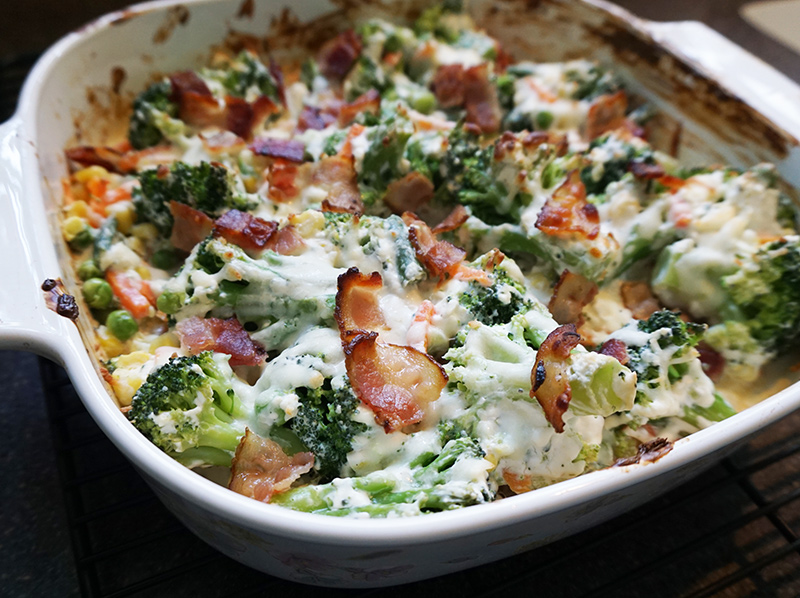
The width and height of the screenshot is (800, 598). Find the location of `cooling rack`. cooling rack is located at coordinates (726, 540).